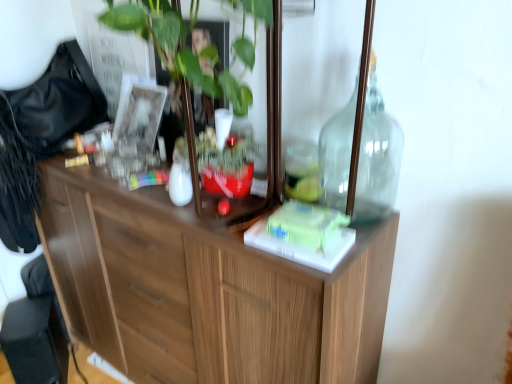
At what (x,y) coordinates should I click in order to perform the action: click on empty space that is ontop of black plastic swivel chair at lower left (from a real-world perspective). Please return your answer as a coordinate pair (x, y). The width and height of the screenshot is (512, 384). Looking at the image, I should click on (25, 322).